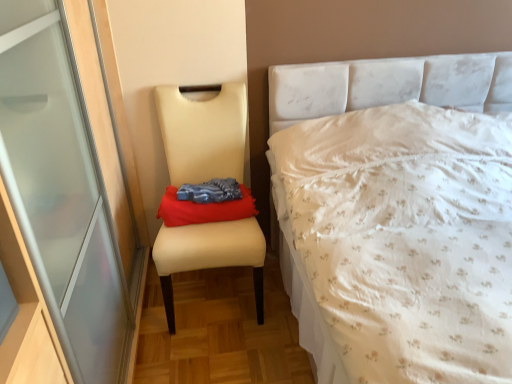
Locate an element on the screen. Image resolution: width=512 pixels, height=384 pixels. vacant area on top of red fabric cloth at center (from a real-world perspective) is located at coordinates (208, 195).